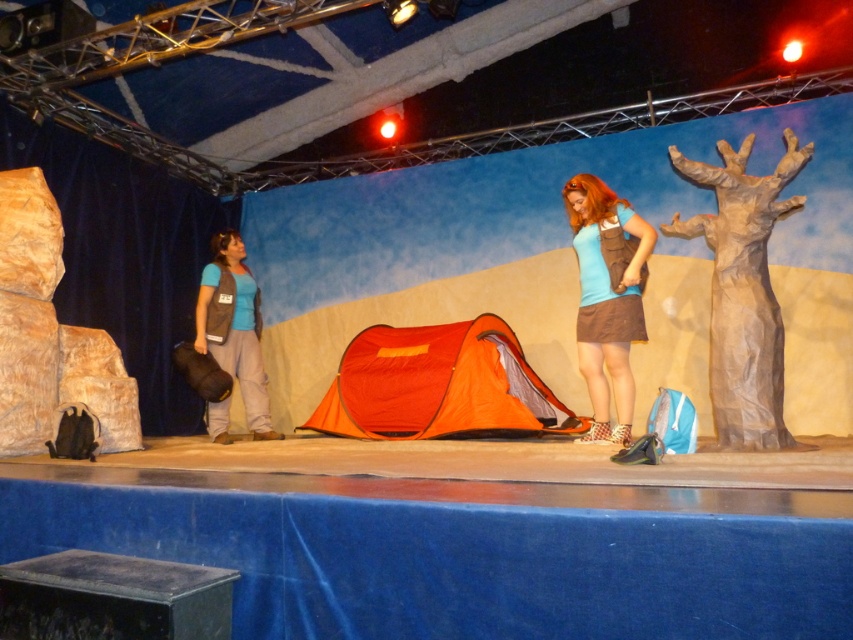
Question: Among these points, which one is farthest from the camera?

Choices:
 (A) (265, 387)
 (B) (631, 378)
 (C) (502, 422)

Answer: (A)

Question: Where is orange pop-up tent at center located in relation to matte brown backpack at center in the image?

Choices:
 (A) left
 (B) right

Answer: (A)

Question: Is matte brown backpack at center positioned at the back of matte gray vest at left?

Choices:
 (A) no
 (B) yes

Answer: (A)

Question: Which point is closer to the camera?

Choices:
 (A) (595, 401)
 (B) (253, 368)

Answer: (A)

Question: Which point is closer to the camera?

Choices:
 (A) matte gray vest at left
 (B) matte brown backpack at center

Answer: (B)

Question: Can you confirm if orange pop-up tent at center is positioned above matte gray vest at left?

Choices:
 (A) yes
 (B) no

Answer: (B)